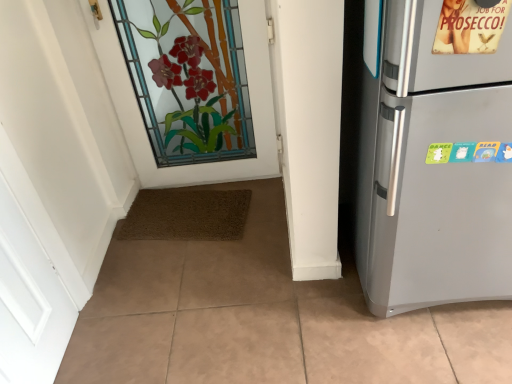
Question: Can you confirm if satin silver refrigerator at right is shorter than stained glass door at upper center?

Choices:
 (A) yes
 (B) no

Answer: (B)

Question: Is satin silver refrigerator at right outside of stained glass door at upper center?

Choices:
 (A) no
 (B) yes

Answer: (B)

Question: Is satin silver refrigerator at right turned away from stained glass door at upper center?

Choices:
 (A) yes
 (B) no

Answer: (B)

Question: From the image's perspective, is satin silver refrigerator at right below stained glass door at upper center?

Choices:
 (A) no
 (B) yes

Answer: (B)

Question: Is satin silver refrigerator at right aimed at stained glass door at upper center?

Choices:
 (A) yes
 (B) no

Answer: (B)

Question: From the image's perspective, is satin silver refrigerator at right above stained glass door at upper center?

Choices:
 (A) no
 (B) yes

Answer: (A)

Question: Is stained glass door at upper center bigger than satin silver refrigerator at right?

Choices:
 (A) yes
 (B) no

Answer: (B)

Question: Is stained glass door at upper center behind satin silver refrigerator at right?

Choices:
 (A) yes
 (B) no

Answer: (A)

Question: Can you confirm if stained glass door at upper center is smaller than satin silver refrigerator at right?

Choices:
 (A) yes
 (B) no

Answer: (A)

Question: From a real-world perspective, is stained glass door at upper center beneath satin silver refrigerator at right?

Choices:
 (A) no
 (B) yes

Answer: (B)

Question: Does stained glass door at upper center have a lesser width compared to satin silver refrigerator at right?

Choices:
 (A) no
 (B) yes

Answer: (B)

Question: From the image's perspective, is stained glass door at upper center beneath satin silver refrigerator at right?

Choices:
 (A) no
 (B) yes

Answer: (A)

Question: In terms of size, does stained glass door at upper center appear bigger or smaller than satin silver refrigerator at right?

Choices:
 (A) small
 (B) big

Answer: (A)